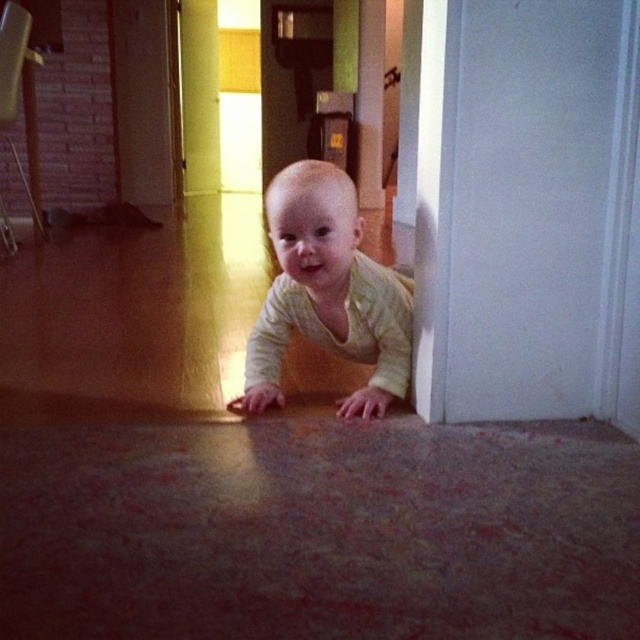
You are a photographer trying to capture the baby crawling near the doorway. You want to focus on the light yellow striped shirt at center and the matte yellow door at upper left. Which object should you adjust your camera focus on first if you want to ensure both are in focus?

The light yellow striped shirt at center is closer to the viewer than the matte yellow door at upper left, so you should focus on the light yellow striped shirt at center first to ensure both are in focus.

You are a photographer setting up a shoot in this scene. You need to place a small prop between the light yellow striped shirt at center and the matte yellow door at upper left. Where should you place it to ensure it is visible in the final photo?

The light yellow striped shirt at center is positioned under the matte yellow door at upper left, so placing the prop between them would require positioning it below the door and above the shirt to ensure visibility in the photo.

The baby is crawling on a textured, reddish brown floor near a doorway. There is a point at coordinates (326, 292). Based on the scene description, where is this point located?

The point at coordinates (326, 292) is on the light yellow striped shirt at center.